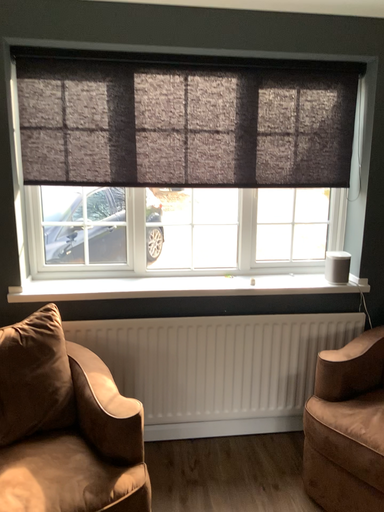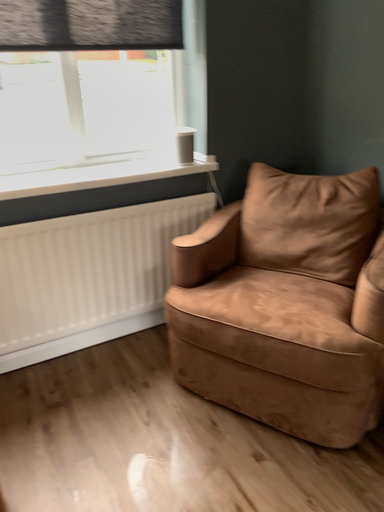
Question: How did the camera likely rotate when shooting the video?

Choices:
 (A) rotated left
 (B) rotated right

Answer: (B)